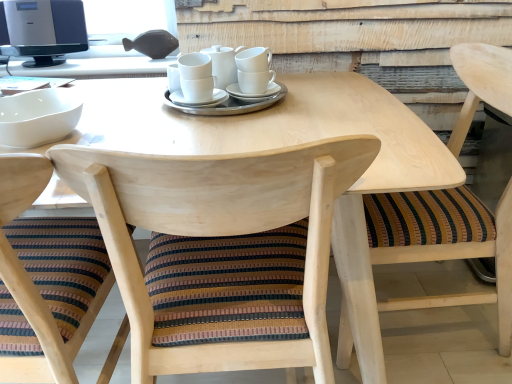
Question: Do you think white ceramic cups at center is within wooden chair with striped cushion at lower left, the 3th chair positioned from the right, or outside of it?

Choices:
 (A) inside
 (B) outside

Answer: (B)

Question: Looking at their shapes, would you say white ceramic cups at center is wider or thinner than wooden chair with striped cushion at lower left, the 3th chair positioned from the right?

Choices:
 (A) thin
 (B) wide

Answer: (A)

Question: Estimate the real-world distances between objects in this image. Which object is closer to the white glossy bowl at left?

Choices:
 (A) white ceramic saucer at center, the 2th saucer positioned from the right
 (B) wooden chair with striped cushion at center, arranged as the 1th chair when viewed from the right
 (C) white ceramic saucer at center, which ranks as the first saucer in right-to-left order
 (D) natural wood chair at center, which ranks as the second chair in right-to-left order
 (E) wooden chair with striped cushion at lower left, the 3th chair positioned from the right

Answer: (E)

Question: Estimate the real-world distances between objects in this image. Which object is farther from the white glossy bowl at left?

Choices:
 (A) satin black monitor at upper left
 (B) white ceramic cups at center
 (C) white ceramic saucer at center, the second saucer viewed from the left
 (D) wooden chair with striped cushion at lower left, the 3th chair positioned from the right
 (E) wooden chair with striped cushion at center, positioned as the third chair in left-to-right order

Answer: (E)